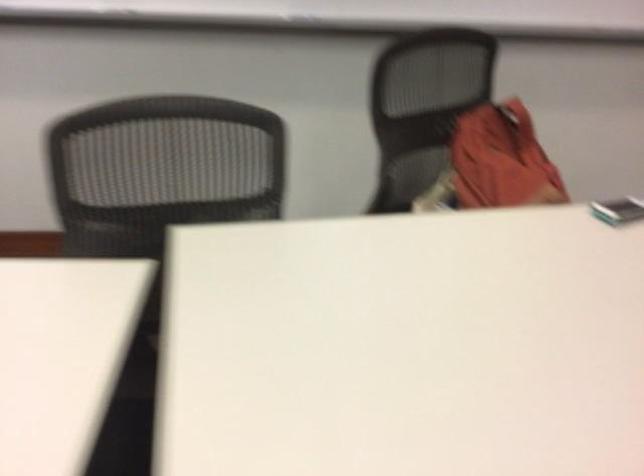
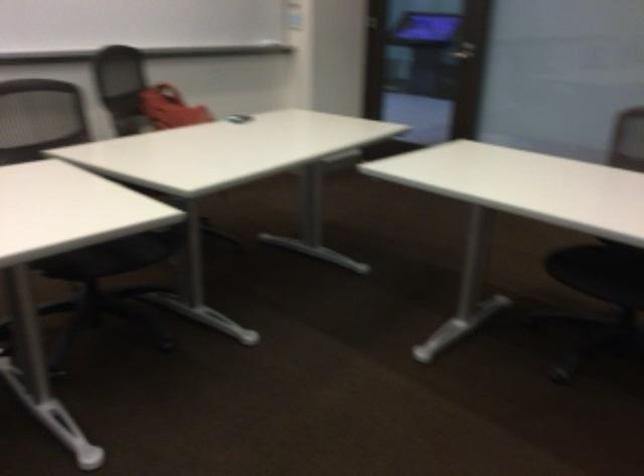
The point at (485, 152) is marked in the first image. Where is the corresponding point in the second image?

(169, 107)